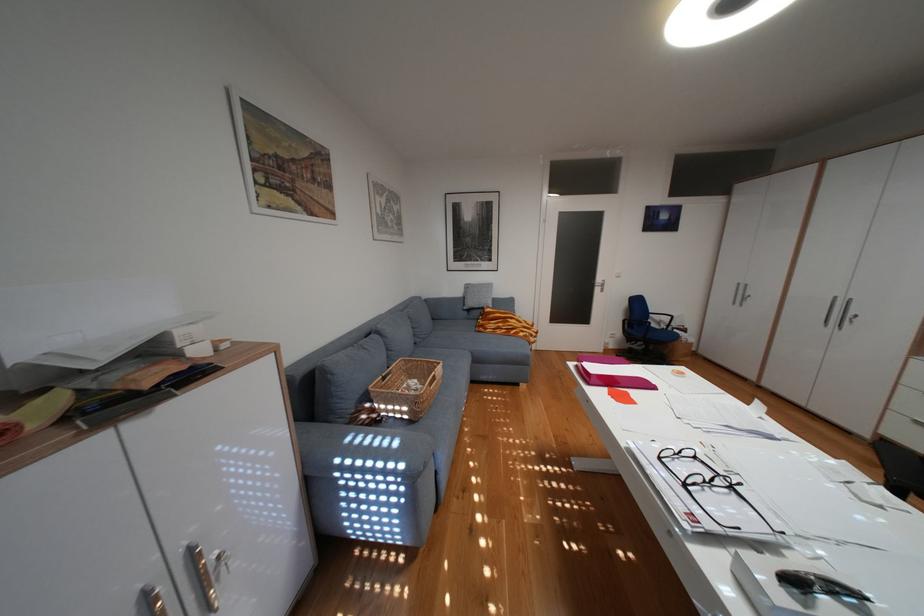
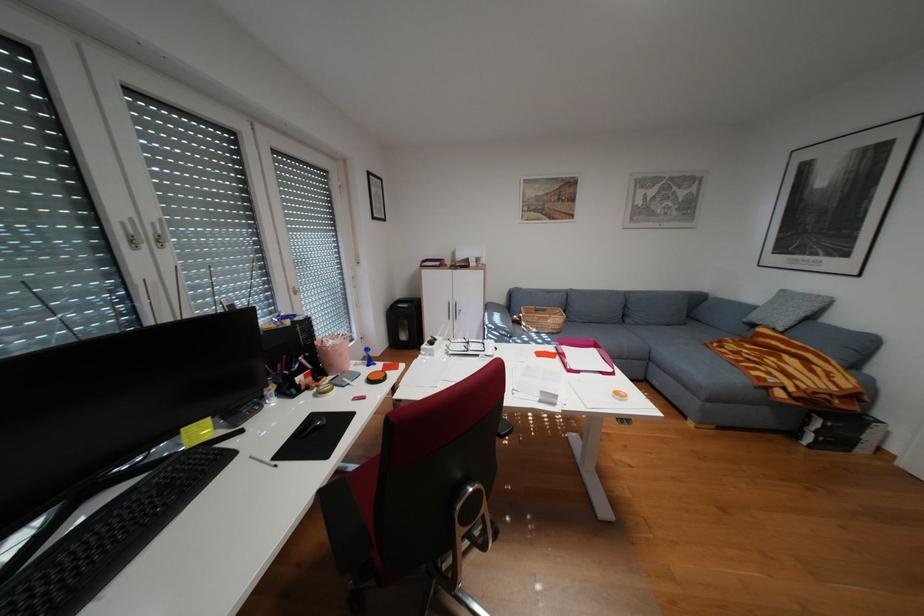
Where in the second image is the point corresponding to point 535,331 from the first image?

(782, 373)